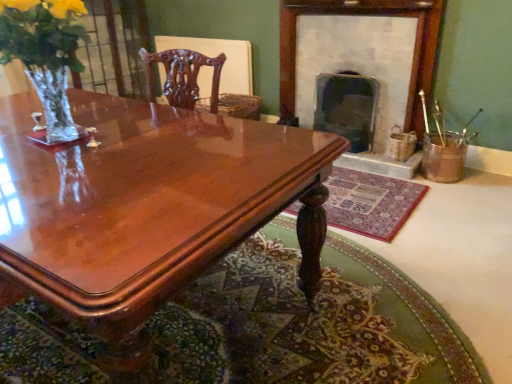
In order to click on vacant space underneath clear glass vase at left (from a real-world perspective) in this screenshot , I will do `click(68, 140)`.